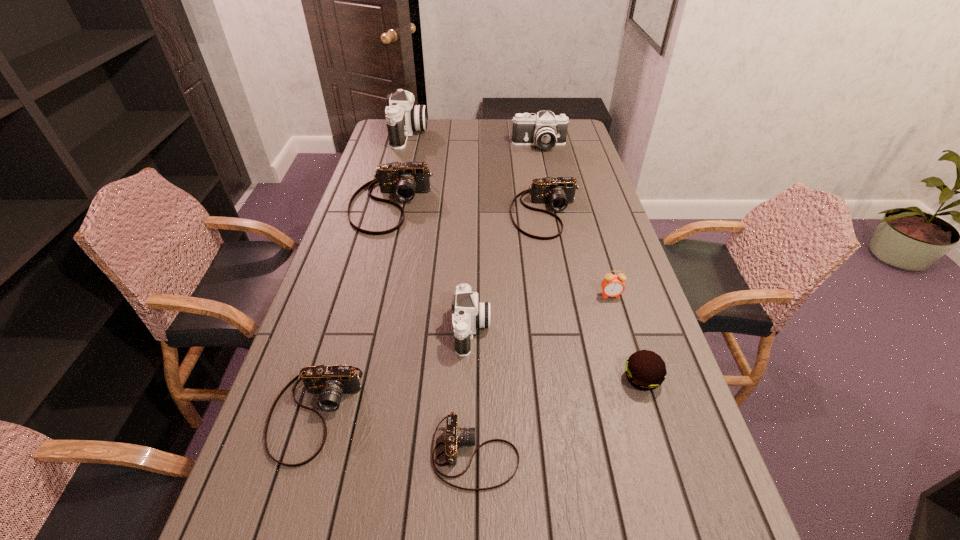
This screenshot has height=540, width=960. What are the coordinates of `camera that stands as the sixth closest to the patty` in the screenshot? It's located at (545, 130).

Find the location of a particular element. This screenshot has width=960, height=540. black camera that is the closest to the fourth nearest object is located at coordinates (545, 130).

Select which black camera appears as the second closest to the second smallest brown camera. Please provide its 2D coordinates. Your answer should be formatted as a tuple, i.e. [(x, y)], where the tuple contains the x and y coordinates of a point satisfying the conditions above.

[(402, 117)]

Identify which brown camera is the fourth nearest to the nearest black camera. Please provide its 2D coordinates. Your answer should be formatted as a tuple, i.e. [(x, y)], where the tuple contains the x and y coordinates of a point satisfying the conditions above.

[(404, 180)]

Identify which brown camera is located as the third nearest to the second biggest brown camera. Please provide its 2D coordinates. Your answer should be formatted as a tuple, i.e. [(x, y)], where the tuple contains the x and y coordinates of a point satisfying the conditions above.

[(454, 436)]

Find the location of a particular element. Image resolution: width=960 pixels, height=540 pixels. free point that satisfies the following two spatial constraints: 1. on the front-facing side of the patty; 2. on the right side of the biggest brown camera is located at coordinates (346, 379).

The height and width of the screenshot is (540, 960). What are the coordinates of `free space that satisfies the following two spatial constraints: 1. on the face of the patty; 2. on the right side of the fifth farthest object` in the screenshot? It's located at (636, 379).

This screenshot has height=540, width=960. Identify the location of vacant area that satisfies the following two spatial constraints: 1. on the front-facing side of the rightmost brown camera; 2. on the front-facing side of the third brown camera from left to right. click(x=590, y=454).